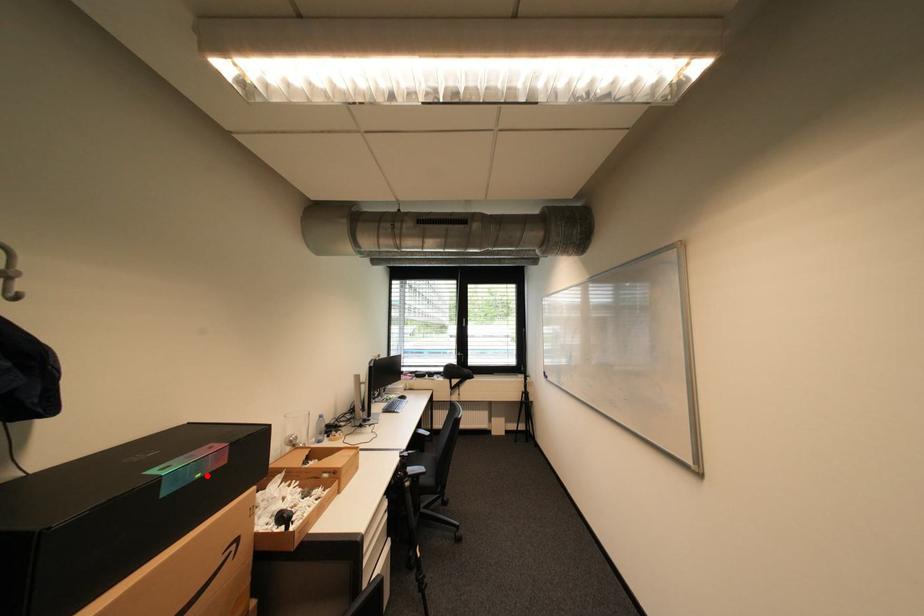
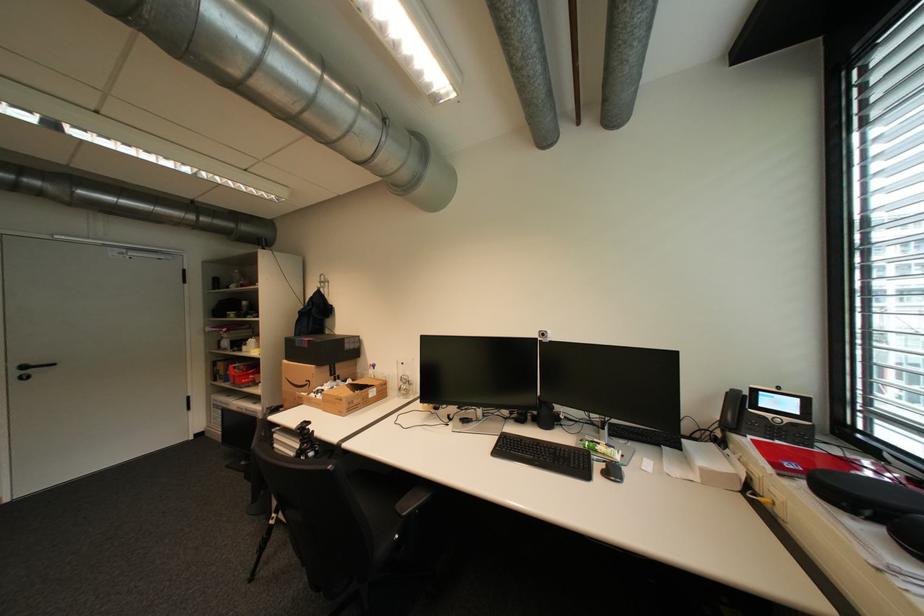
The point at the highlighted location is marked in the first image. Where is the corresponding point in the second image?

(310, 346)